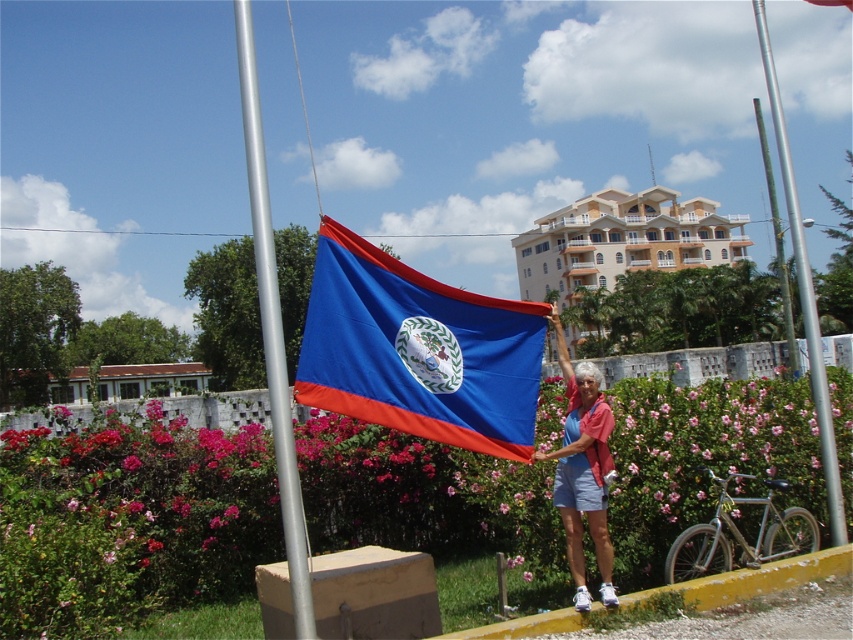
You are a photographer trying to capture the Belizean flag and its surroundings. You notice the matte blue shorts at center and the green patina pole at upper right. Which object should you focus on first if you want to include both in your frame without moving the camera?

You should focus on the matte blue shorts at center first because it is positioned to the left of the green patina pole at upper right, so capturing it first ensures both objects remain within the frame.

You are a painter who wants to paint the flag and the pole. You have two brushes, one for small details and one for large areas. Which brush should you use for the blue fabric flag at center and which for the silver metallic pole at center?

The blue fabric flag at center has a smaller size compared to the silver metallic pole at center, so use the small brush for the flag and the large brush for the pole.